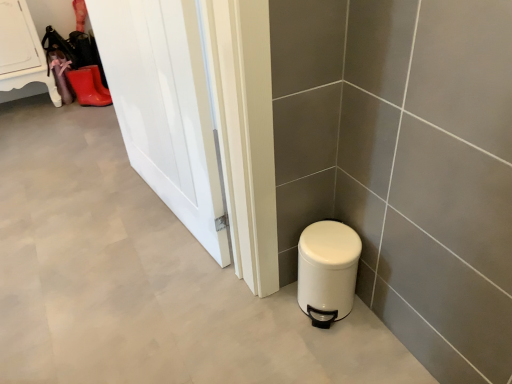
Locate an element on the screen. The image size is (512, 384). vacant space that is to the left of white matte trash can at lower right is located at coordinates (265, 314).